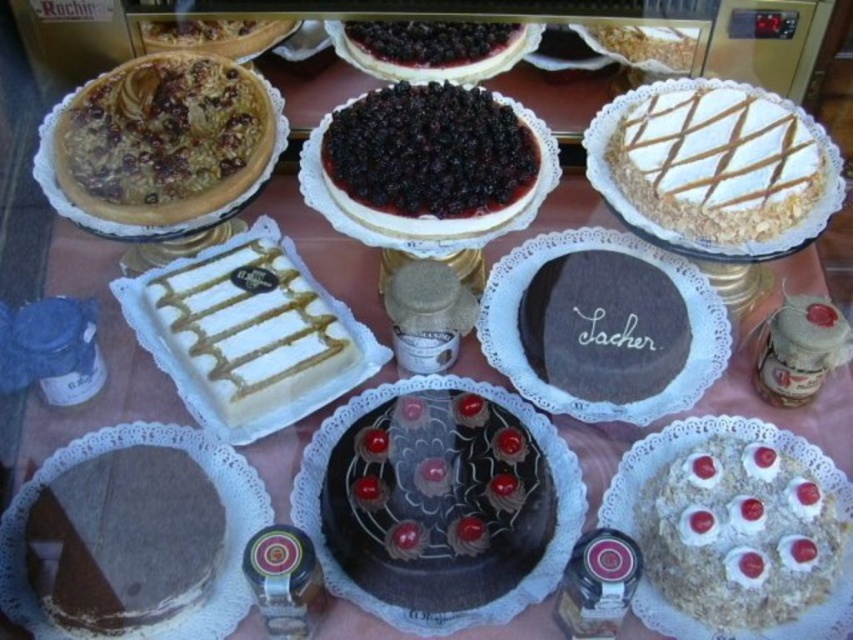
You are a customer at the bakery and want to point out the matte brown pie at upper left and the white glossy cake at center to the cashier. Which one is positioned higher on the shelf?

The matte brown pie at upper left is positioned higher on the shelf than the white glossy cake at center.

You are a customer at the bakery and want to buy both the matte brown pie at upper left and the white glossy cake at center. If you start from the entrance, which item should you approach first to reach them in order from left to right?

The matte brown pie at upper left is to the left of the white glossy cake at center, so you should approach the matte brown pie at upper left first before reaching the white glossy cake at center.

You are a customer at the bakery and want to point out the matte brown pie at upper left and the white textured cake at upper right to the cashier. Which one is closer to you?

The matte brown pie at upper left is closer to you because it is in front of the white textured cake at upper right.